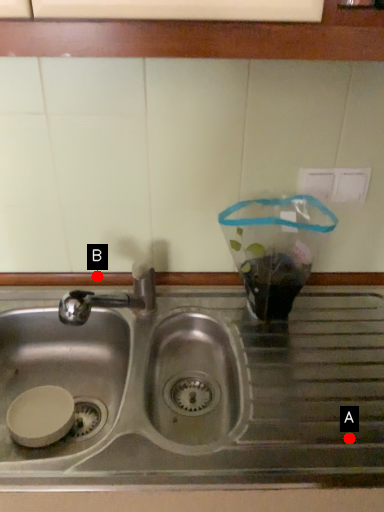
Question: Two points are circled on the image, labeled by A and B beside each circle. Which of the following is the closest to the observer?

Choices:
 (A) A is closer
 (B) B is closer

Answer: (A)